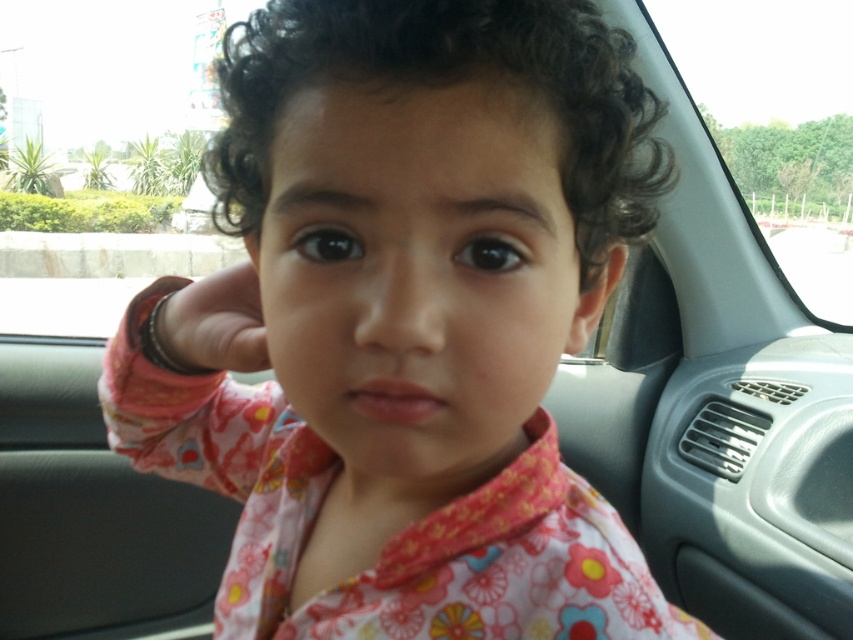
Question: Which point is closer to the camera?

Choices:
 (A) transparent glass car window at upper right
 (B) floral fabric shirt at center
 (C) metallic bracelet at left

Answer: (B)

Question: Where is floral fabric shirt at center located in relation to metallic bracelet at left in the image?

Choices:
 (A) left
 (B) right

Answer: (B)

Question: Among these points, which one is nearest to the camera?

Choices:
 (A) (167, 301)
 (B) (746, 188)

Answer: (A)

Question: Is floral fabric shirt at center wider than metallic bracelet at left?

Choices:
 (A) no
 (B) yes

Answer: (B)

Question: Does floral fabric shirt at center have a larger size compared to transparent glass car window at upper right?

Choices:
 (A) yes
 (B) no

Answer: (A)

Question: Which point is farther to the camera?

Choices:
 (A) metallic bracelet at left
 (B) transparent glass car window at upper right
 (C) floral fabric shirt at center

Answer: (B)